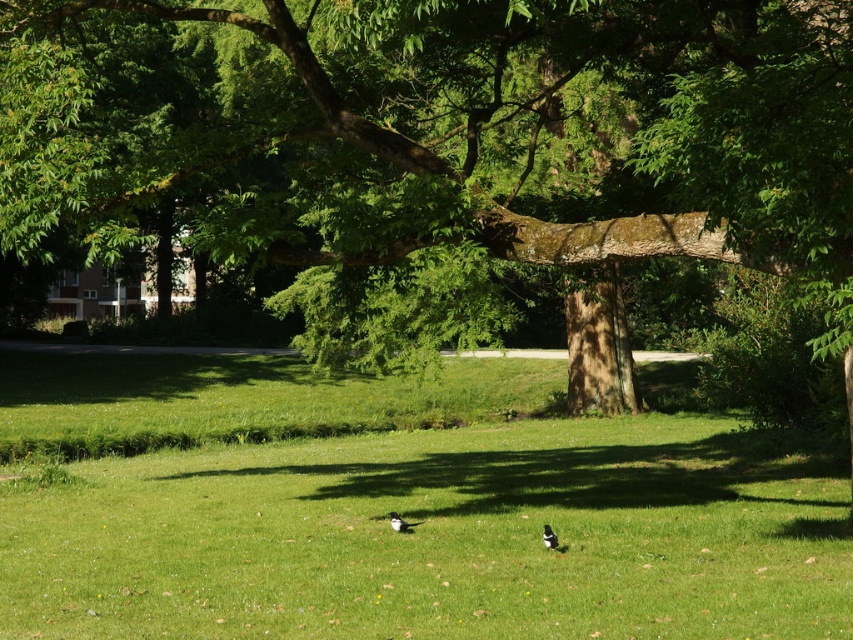
You are a photographer trying to capture both the green leafy tree at center and the white glossy bird at center in a single shot. Given their sizes, which one will occupy more space in your photo?

The green leafy tree at center is bigger than the white glossy bird at center, so it will occupy more space in the photo.

You are a photographer trying to capture the white glossy bird at center in the park. Since the green grassy field at center is in the background, will the bird be easily visible against the grass?

The green grassy field at center has a larger size compared to white glossy bird at center, but the bird will still be visible because its white and glossy plumage contrasts with the green grass.

You are standing in the park and want to take a photo of the green leafy tree at center. If your camera has a maximum focus range of 30 feet, will you be able to capture the tree clearly without moving closer?

The green leafy tree at center is 30.96 feet away from the viewer. Since the camera can only focus up to 30 feet, you are slightly out of range and will need to move closer to ensure the tree is in focus.